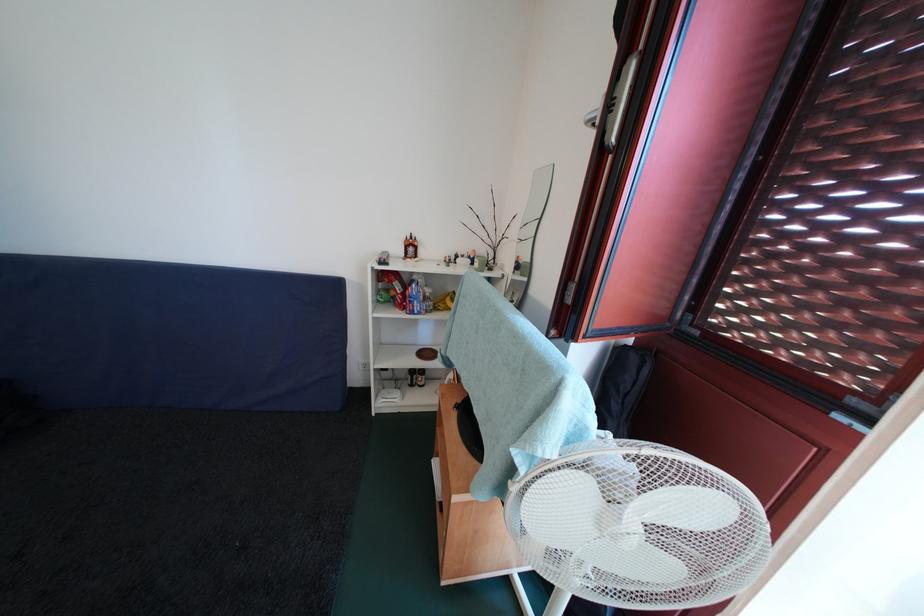
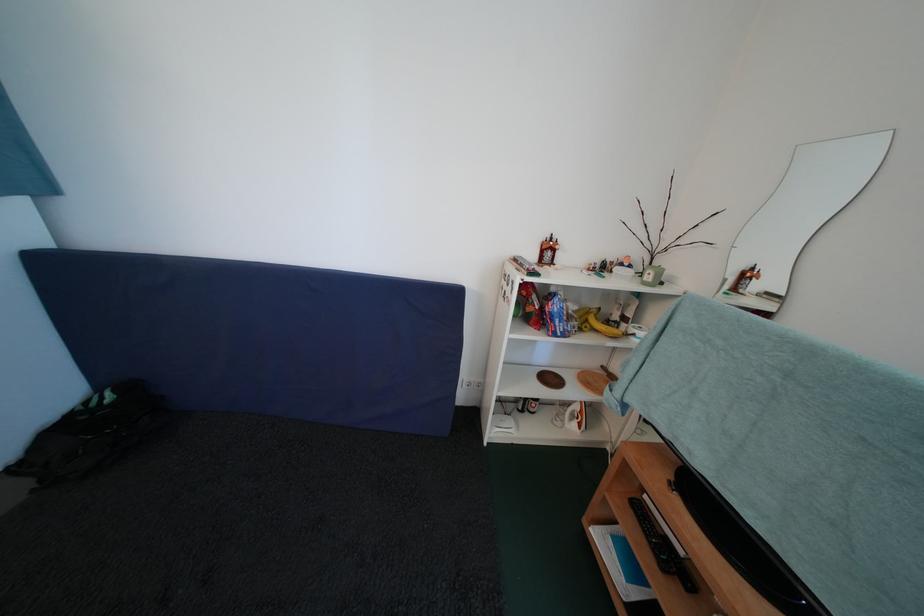
The point at (433, 359) is marked in the first image. Where is the corresponding point in the second image?

(556, 384)